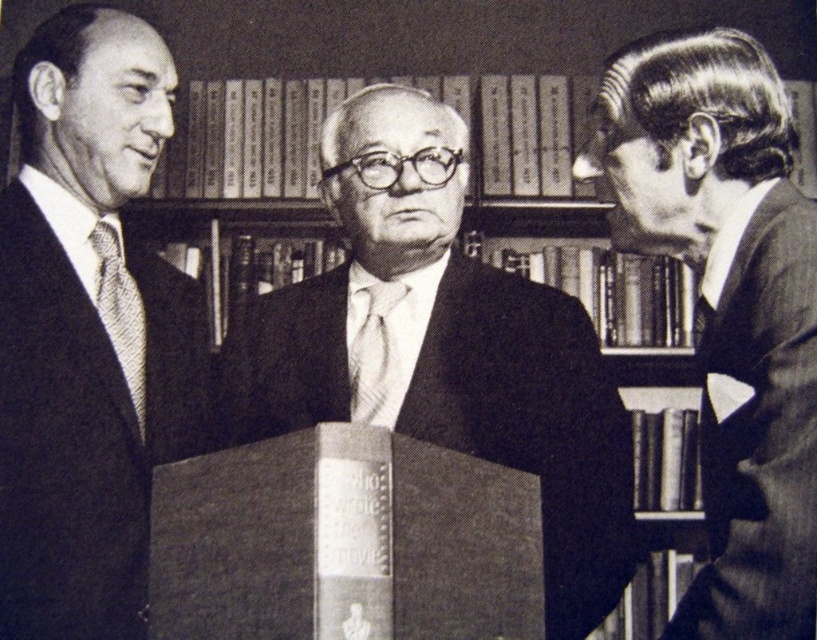
In the scene, you notice two items of clothing worn by the men in the photograph. The dark gray wool suit at right and the white textured tie at center. Which of these items is located to the right of the other?

The dark gray wool suit at right is positioned on the right side of white textured tie at center.